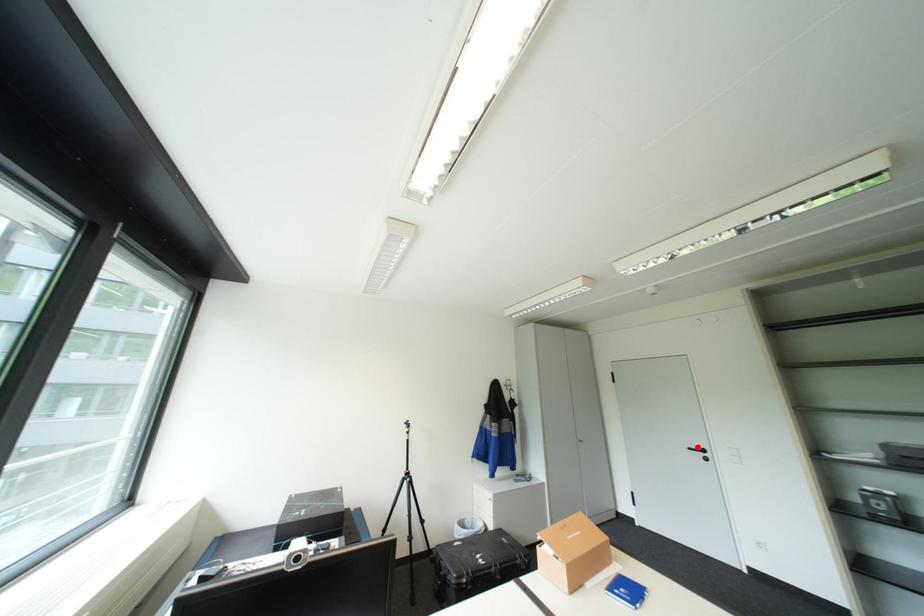
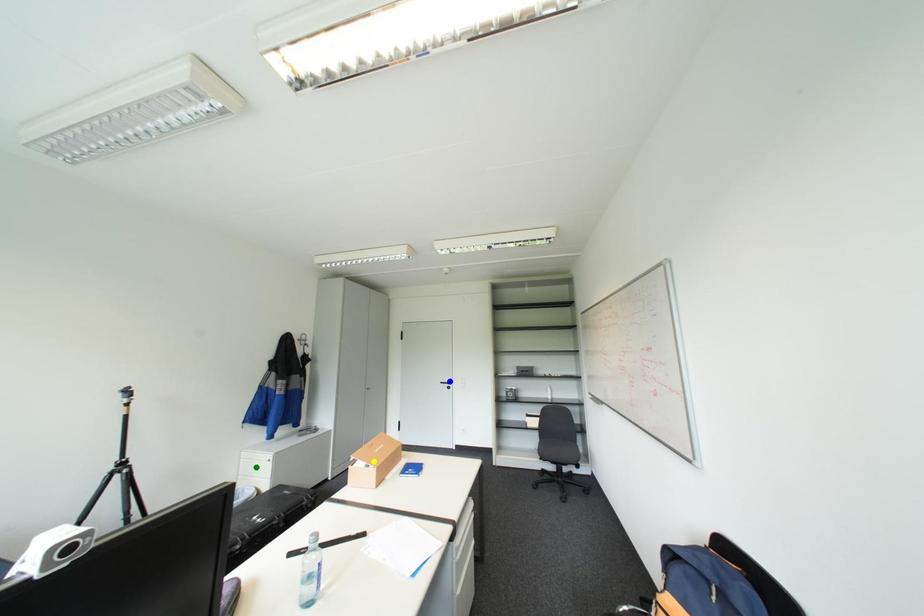
Question: I am providing you with two images of the same scene from different viewpoints. A red point is marked on the first image. You are given multiple points on the second image. Can you choose the point in image 2 that corresponds to the point in image 1?

Choices:
 (A) blue point
 (B) yellow point
 (C) green point

Answer: (A)